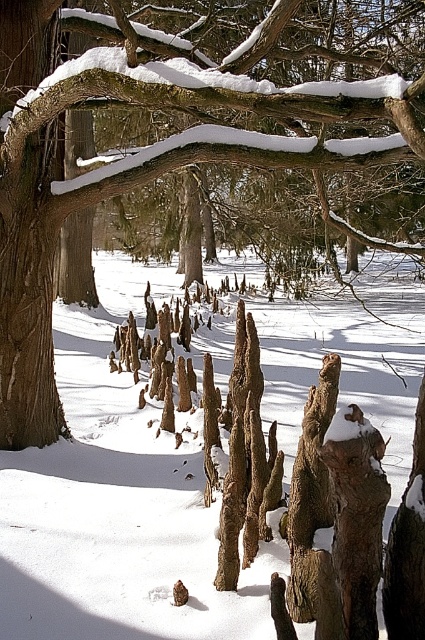
You are an explorer in the winter forest and want to reach the smooth bark tree trunk at center. You notice the white powdery snow at center in your path. Which object do you need to step over or around to get to the tree trunk?

You need to step over or around the white powdery snow at center because the smooth bark tree trunk at center is behind it, meaning the snow is blocking the path directly to the tree trunk.

Based on the scene description, where is the white powdery snow at center located in terms of coordinates?

The white powdery snow at center is located at coordinates point (116, 500).

In the winter forest scene, there is white powdery snow at center and a smooth bark tree trunk at center. Which of these two objects occupies a larger area in the image?

The white powdery snow at center is bigger than the smooth bark tree trunk at center, so it occupies a larger area in the image.